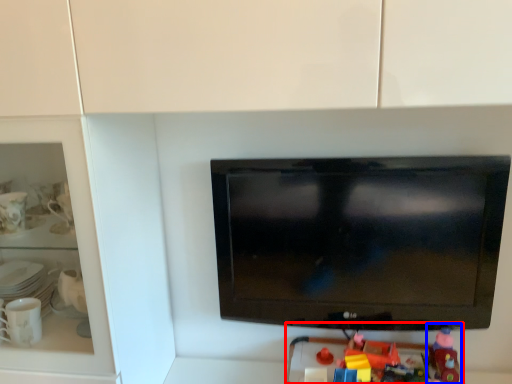
Question: Which point is closer to the camera, toy (highlighted by a red box) or toy (highlighted by a blue box)?

Choices:
 (A) toy
 (B) toy

Answer: (A)